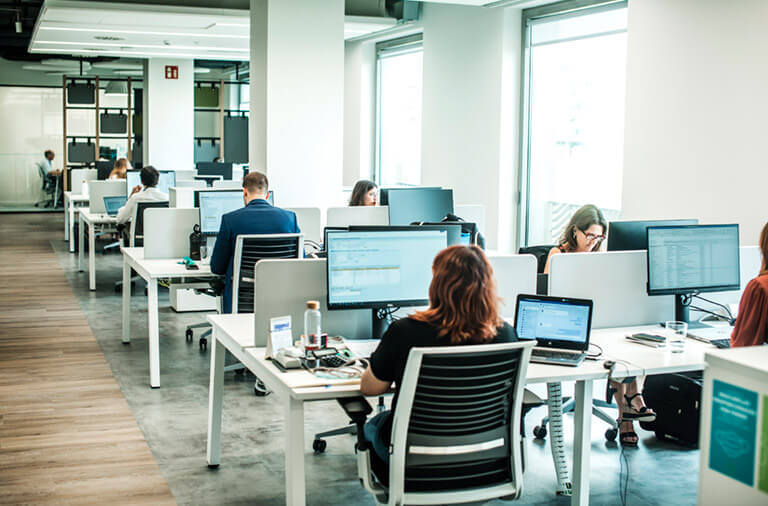
The image size is (768, 506). In order to click on legs of table in this screenshot , I will do `click(216, 425)`, `click(296, 469)`, `click(583, 432)`, `click(150, 304)`, `click(124, 292)`, `click(93, 270)`, `click(78, 246)`, `click(71, 236)`, `click(65, 212)`.